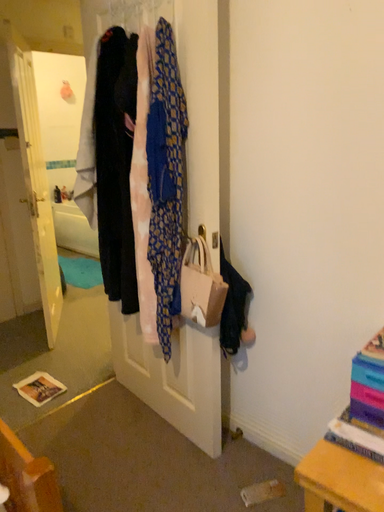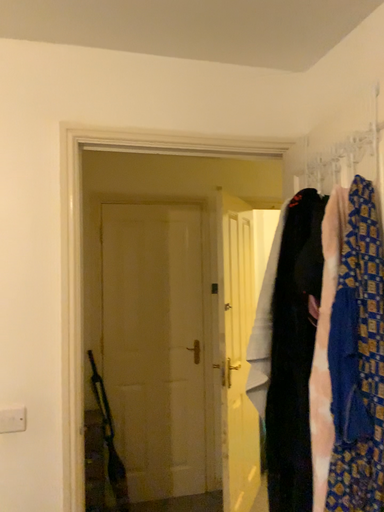
Question: How did the camera likely rotate when shooting the video?

Choices:
 (A) rotated right
 (B) rotated left

Answer: (B)